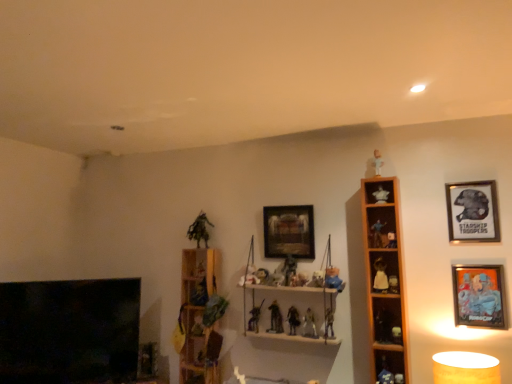
Question: Is metallic silver figure at center, arranged as the 8th toy when viewed from the left, not near matte gold table lamp at lower right?

Choices:
 (A) yes
 (B) no

Answer: (B)

Question: From a real-world perspective, is metallic silver figure at center, which is the thirteenth toy in right-to-left order, located higher than matte gold table lamp at lower right?

Choices:
 (A) yes
 (B) no

Answer: (A)

Question: From the image's perspective, would you say metallic silver figure at center, arranged as the 8th toy when viewed from the left, is positioned over matte gold table lamp at lower right?

Choices:
 (A) no
 (B) yes

Answer: (B)

Question: From the image's perspective, is metallic silver figure at center, arranged as the 8th toy when viewed from the left, below matte gold table lamp at lower right?

Choices:
 (A) no
 (B) yes

Answer: (A)

Question: From a real-world perspective, is metallic silver figure at center, which is the thirteenth toy in right-to-left order, beneath matte gold table lamp at lower right?

Choices:
 (A) no
 (B) yes

Answer: (A)

Question: Based on their sizes in the image, would you say matte black action figure at upper right, which is the 19th toy from left to right, is bigger or smaller than metallic silver figurine at center, the 7th toy positioned from the left?

Choices:
 (A) small
 (B) big

Answer: (A)

Question: Does point (387, 236) appear closer or farther from the camera than point (282, 269)?

Choices:
 (A) closer
 (B) farther

Answer: (A)

Question: From a real-world perspective, is matte black action figure at upper right, which is the 19th toy from left to right, positioned above or below metallic silver figurine at center, the 7th toy positioned from the left?

Choices:
 (A) below
 (B) above

Answer: (B)

Question: From the image's perspective, is matte black action figure at upper right, which is the 19th toy from left to right, above or below metallic silver figurine at center, placed as the 14th toy when sorted from right to left?

Choices:
 (A) above
 (B) below

Answer: (A)

Question: Based on their positions, is metallic silver picture frame at right, the 3th picture frame in the back-to-front sequence, located to the left or right of metallic silver figure at center, which appears as the 12th toy when viewed from the right?

Choices:
 (A) left
 (B) right

Answer: (B)

Question: From a real-world perspective, relative to metallic silver figure at center, the ninth toy when ordered from left to right, is metallic silver picture frame at right, the 2th picture frame from the left, vertically above or below?

Choices:
 (A) below
 (B) above

Answer: (B)

Question: From their relative heights in the image, would you say metallic silver picture frame at right, which appears as the 2th picture frame when viewed from the right, is taller or shorter than metallic silver figure at center, the ninth toy when ordered from left to right?

Choices:
 (A) short
 (B) tall

Answer: (B)

Question: Considering the positions of metallic silver picture frame at right, the 3th picture frame in the back-to-front sequence, and metallic silver figure at center, the ninth toy when ordered from left to right, in the image, is metallic silver picture frame at right, the 3th picture frame in the back-to-front sequence, wider or thinner than metallic silver figure at center, the ninth toy when ordered from left to right,?

Choices:
 (A) thin
 (B) wide

Answer: (A)

Question: Is matte plastic figurine at center, which is counted as the 19th toy, starting from the right, wider or thinner than metallic silver figurine at upper right, the seventeenth toy in the left-to-right sequence?

Choices:
 (A) thin
 (B) wide

Answer: (B)

Question: Considering the positions of matte plastic figurine at center, the 2th toy viewed from the left, and metallic silver figurine at upper right, the seventeenth toy in the left-to-right sequence, in the image, is matte plastic figurine at center, the 2th toy viewed from the left, taller or shorter than metallic silver figurine at upper right, the seventeenth toy in the left-to-right sequence,?

Choices:
 (A) short
 (B) tall

Answer: (B)